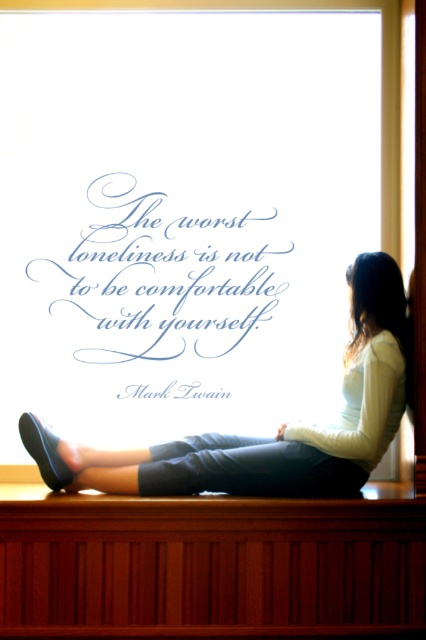
You are standing in the room and see two points marked in the image. Which point is closer to you, point [184,625] or point [351,406]?

Point [184,625] is in front of point [351,406], so it is closer to you.

You are a delivery person who needs to place a small package on the wooden ledge at lower center. However, there is a light beige sweater at lower right on it. Can you place the package there without moving the sweater?

The wooden ledge at lower center is in front of the light beige sweater at lower right, meaning the sweater is behind the ledge. Therefore, you can place the package on the wooden ledge at lower center without disturbing the sweater.